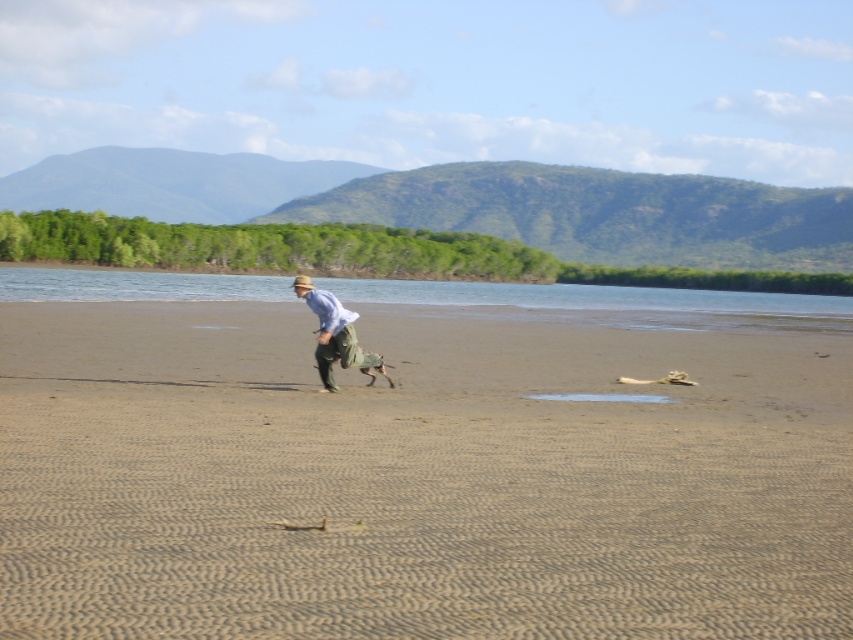
Is point (469, 525) farther from viewer compared to point (788, 292)?

No, it is in front of (788, 292).

Who is shorter, brown sandy beach at center or clear blue water at center?

With less height is brown sandy beach at center.

The image size is (853, 640). What do you see at coordinates (416, 477) in the screenshot?
I see `brown sandy beach at center` at bounding box center [416, 477].

Image resolution: width=853 pixels, height=640 pixels. Find the location of `brown sandy beach at center`. brown sandy beach at center is located at coordinates (416, 477).

Between point (0, 570) and point (329, 298), which one is positioned behind?

Positioned behind is point (329, 298).

Between brown sandy beach at center and light blue cotton shirt at center, which one is positioned lower?

Positioned lower is brown sandy beach at center.

Which is behind, point (78, 388) or point (337, 339)?

The point (337, 339) is more distant.

The image size is (853, 640). In order to click on brown sandy beach at center in this screenshot , I will do `click(416, 477)`.

In the scene shown: Is clear blue water at center above light blue cotton shirt at center?

Correct, clear blue water at center is located above light blue cotton shirt at center.

Based on the photo, measure the distance between point (209,292) and camera.

Point (209,292) is 236.13 feet from camera.

Who is more forward, (331, 280) or (383, 364)?

Point (383, 364) is more forward.

In order to click on clear blue water at center in this screenshot , I will do `click(598, 300)`.